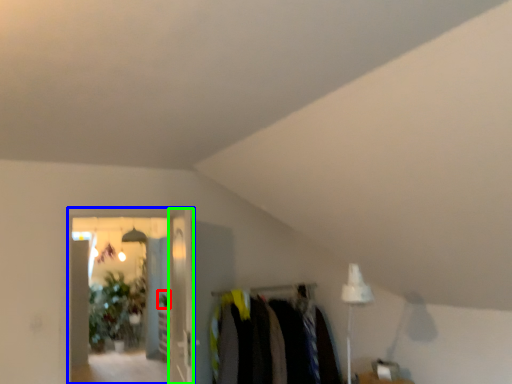
Question: Which object is the closest to the plant (highlighted by a red box)? Choose among these: glass door (highlighted by a blue box) or glass door (highlighted by a green box).

Choices:
 (A) glass door
 (B) glass door

Answer: (B)